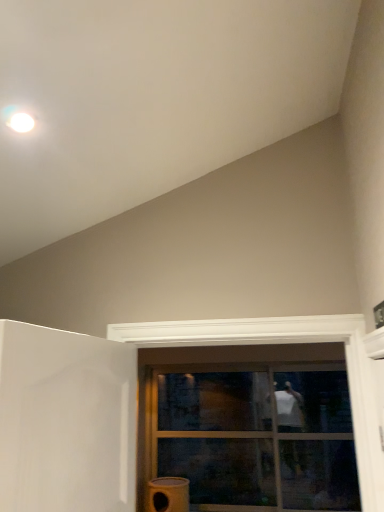
In order to face clear glass window at center, should I rotate leftwards or rightwards?

You should look right and rotate roughly 7.175 degrees.

What do you see at coordinates (249, 426) in the screenshot? This screenshot has width=384, height=512. I see `clear glass window at center` at bounding box center [249, 426].

Find the location of `clear glass window at center`. clear glass window at center is located at coordinates (249, 426).

Considering the sizes of objects clear glass window at center and matte yellow water heater at lower center in the image provided, who is bigger, clear glass window at center or matte yellow water heater at lower center?

clear glass window at center.

In the scene shown: Is clear glass window at center oriented towards matte yellow water heater at lower center?

No.

Does point (254, 467) come in front of point (168, 505)?

No, it is not.

Does clear glass window at center appear on the right side of matte yellow water heater at lower center?

Yes, clear glass window at center is to the right of matte yellow water heater at lower center.

Is clear glass window at center taller or shorter than transparent glass door at center?

Considering their sizes, clear glass window at center has more height than transparent glass door at center.

You are a GUI agent. You are given a task and a screenshot of the screen. Output one action in this format:
    pyautogui.click(x=<x>, y=<y>)
    Task: Click on the window that is above the transparent glass door at center (from the image's perspective)
    This screenshot has height=512, width=384.
    Given the screenshot: What is the action you would take?
    pyautogui.click(x=249, y=426)

Can you confirm if clear glass window at center is bigger than transparent glass door at center?

Indeed, clear glass window at center has a larger size compared to transparent glass door at center.

Can we say clear glass window at center lies outside transparent glass door at center?

Absolutely, clear glass window at center is external to transparent glass door at center.

In order to click on glass door located on the left of clear glass window at center in this screenshot , I will do `click(218, 436)`.

Which of these two, transparent glass door at center or clear glass window at center, is smaller?

With smaller size is transparent glass door at center.

From the image's perspective, does transparent glass door at center appear lower than clear glass window at center?

Yes.

The image size is (384, 512). Find the location of `water heater below the transparent glass door at center (from the image's perspective)`. water heater below the transparent glass door at center (from the image's perspective) is located at coordinates (168, 494).

From the image's perspective, between transparent glass door at center and matte yellow water heater at lower center, which one is located above?

From the image's view, transparent glass door at center is above.

From a real-world perspective, between transparent glass door at center and matte yellow water heater at lower center, who is vertically higher?

transparent glass door at center is physically above.

Considering the positions of points (178, 375) and (149, 503), is point (178, 375) farther from camera compared to point (149, 503)?

That is True.

From a real-world perspective, which object rests below the other?

In real-world perspective, matte yellow water heater at lower center is lower.

Is matte yellow water heater at lower center aimed at clear glass window at center?

No, matte yellow water heater at lower center is not turned towards clear glass window at center.

Is matte yellow water heater at lower center touching clear glass window at center?

matte yellow water heater at lower center is not next to clear glass window at center, and they're not touching.

Considering the relative sizes of matte yellow water heater at lower center and clear glass window at center in the image provided, is matte yellow water heater at lower center shorter than clear glass window at center?

Correct, matte yellow water heater at lower center is not as tall as clear glass window at center.

Does point (152, 489) come behind point (249, 425)?

No.

From a real-world perspective, is matte yellow water heater at lower center located higher than transparent glass door at center?

No.

Considering the relative sizes of matte yellow water heater at lower center and transparent glass door at center in the image provided, is matte yellow water heater at lower center shorter than transparent glass door at center?

Yes, matte yellow water heater at lower center is shorter than transparent glass door at center.

Is matte yellow water heater at lower center situated inside transparent glass door at center or outside?

matte yellow water heater at lower center is spatially situated outside transparent glass door at center.

Locate an element on the screen. The height and width of the screenshot is (512, 384). window above the matte yellow water heater at lower center (from the image's perspective) is located at coordinates (249, 426).

Locate an element on the screen. window on the right of transparent glass door at center is located at coordinates (249, 426).

Estimate the real-world distances between objects in this image. Which object is closer to transparent glass door at center, clear glass window at center or matte yellow water heater at lower center?

Based on the image, clear glass window at center appears to be nearer to transparent glass door at center.

Considering their positions, is matte yellow water heater at lower center positioned further to clear glass window at center than transparent glass door at center?

Among the two, matte yellow water heater at lower center is located further to clear glass window at center.

Considering their positions, is clear glass window at center positioned further to matte yellow water heater at lower center than transparent glass door at center?

clear glass window at center.

Based on their spatial positions, is transparent glass door at center or clear glass window at center closer to matte yellow water heater at lower center?

Among the two, transparent glass door at center is located nearer to matte yellow water heater at lower center.

Looking at the image, which one is located closer to transparent glass door at center, matte yellow water heater at lower center or clear glass window at center?

Based on the image, clear glass window at center appears to be nearer to transparent glass door at center.

Looking at the image, which one is located closer to clear glass window at center, transparent glass door at center or matte yellow water heater at lower center?

transparent glass door at center.

Where is `glass door situated between matte yellow water heater at lower center and clear glass window at center from left to right`? glass door situated between matte yellow water heater at lower center and clear glass window at center from left to right is located at coordinates (218, 436).